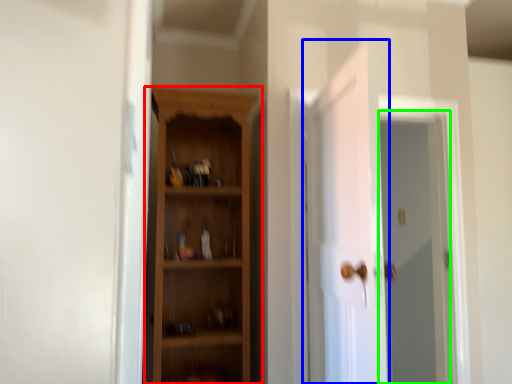
Question: Considering the real-world distances, which object is farthest from cupboard (highlighted by a red box)? door (highlighted by a blue box) or screen door (highlighted by a green box)?

Choices:
 (A) door
 (B) screen door

Answer: (B)